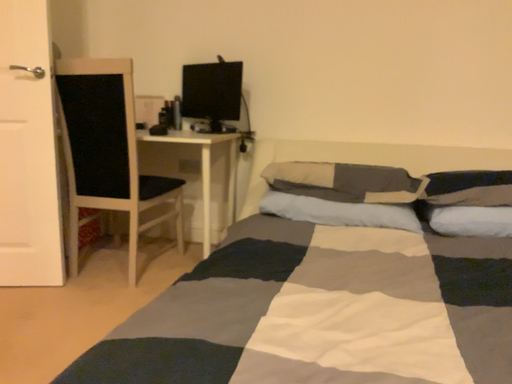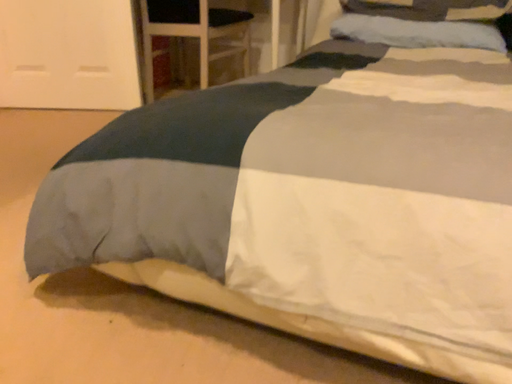
Question: Which way did the camera rotate in the video?

Choices:
 (A) rotated right
 (B) rotated left

Answer: (B)